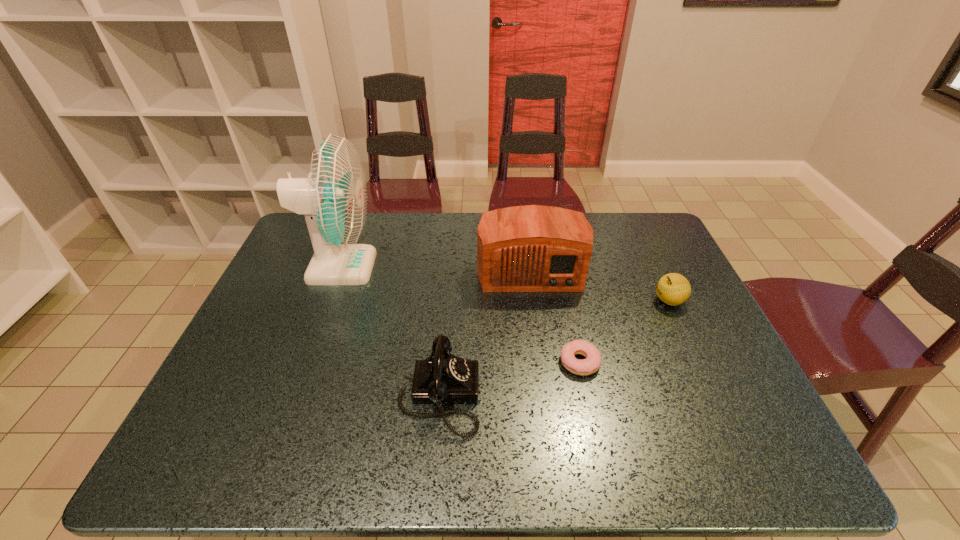
Locate an element on the screen. This screenshot has height=540, width=960. vacant region located on the logo side of the rightmost object is located at coordinates (571, 301).

Locate an element on the screen. vacant space located 0.120m on the logo side of the rightmost object is located at coordinates (611, 301).

Locate an element on the screen. Image resolution: width=960 pixels, height=540 pixels. vacant space situated on the logo side of the rightmost object is located at coordinates (596, 301).

Identify the location of vacant space located on the right of the doughnut. The width and height of the screenshot is (960, 540). (722, 362).

This screenshot has width=960, height=540. In order to click on fan located at the far edge in this screenshot , I will do `click(333, 198)`.

Image resolution: width=960 pixels, height=540 pixels. What are the coordinates of `radio receiver that is at the far edge` in the screenshot? It's located at (533, 248).

Locate an element on the screen. The image size is (960, 540). object at the near edge is located at coordinates (442, 377).

The height and width of the screenshot is (540, 960). I want to click on object that is at the left edge, so click(333, 198).

Where is `object that is positioned at the right edge`? object that is positioned at the right edge is located at coordinates (673, 289).

You are a GUI agent. You are given a task and a screenshot of the screen. Output one action in this format:
    pyautogui.click(x=<x>, y=<y>)
    Task: Click on the object that is at the far left corner
    Image resolution: width=960 pixels, height=540 pixels.
    Given the screenshot: What is the action you would take?
    point(333,198)